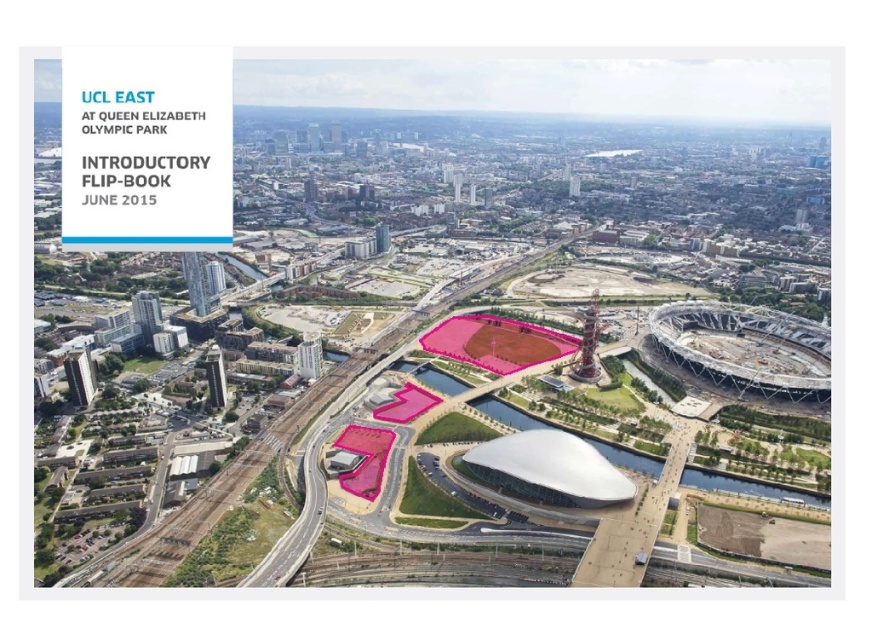
You are a drone operator tasked with capturing aerial footage of the Queen Elizabeth Olympic Park. You need to ensure that both the white smooth stadium at center and the pink matte football field at center are visible in the shot. Based on their positions, which object should appear higher in the frame?

The white smooth stadium at center is above the pink matte football field at center, so it will appear higher in the frame.

You are a city planner reviewing the aerial view of the Queen Elizabeth Olympic Park. You need to determine if the white smooth stadium at center can accommodate a new event that requires a space wider than the pink matte football field at center. Based on the provided information, can the stadium potentially host this event?

The white smooth stadium at center might be wider than the pink matte football field at center, so it could potentially accommodate the event requiring a wider space.

You are a city planner reviewing an aerial map of the Queen Elizabeth Olympic Park. You see a point marked at coordinates (270, 460). What significant structure does this point indicate?

The point at coordinates (270, 460) corresponds to the white smooth stadium at center.